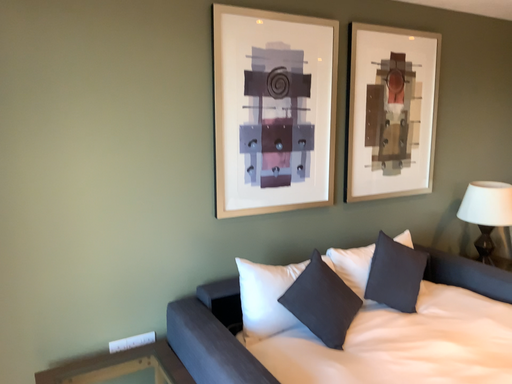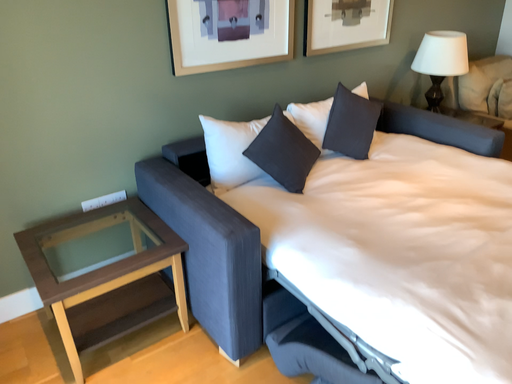
Question: Which way did the camera rotate in the video?

Choices:
 (A) rotated downward
 (B) rotated upward

Answer: (A)